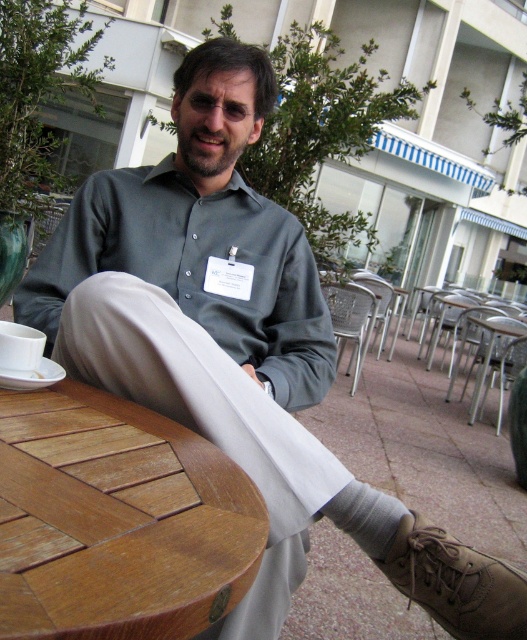
Question: Estimate the real-world distances between objects in this image. Which object is farther from the gray knitted sock at lower center?

Choices:
 (A) tan leather shoe at lower right
 (B) brown wooden table at center

Answer: (B)

Question: Which object is the closest to the gray knitted sock at lower center?

Choices:
 (A) brown wooden table at center
 (B) tan leather shoe at lower right

Answer: (B)

Question: Does brown wooden table at center have a smaller size compared to gray knitted sock at lower center?

Choices:
 (A) no
 (B) yes

Answer: (A)

Question: Is tan leather shoe at lower right to the right of gray knitted sock at lower center from the viewer's perspective?

Choices:
 (A) no
 (B) yes

Answer: (B)

Question: Based on their relative distances, which object is nearer to the tan leather shoe at lower right?

Choices:
 (A) brown wooden table at center
 (B) gray knitted sock at lower center

Answer: (B)

Question: From the image, what is the correct spatial relationship of tan leather shoe at lower right in relation to gray knitted sock at lower center?

Choices:
 (A) right
 (B) left

Answer: (A)